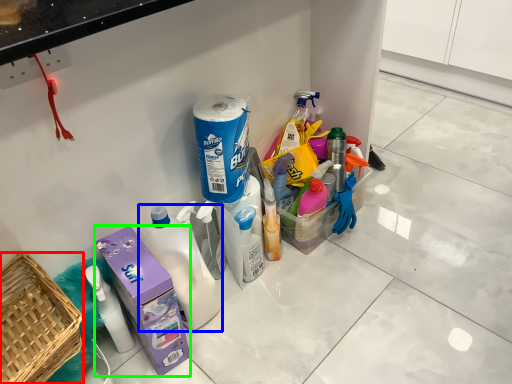
Question: Based on their relative distances, which object is nearer to basket (highlighted by a red box)? Choose from bottle (highlighted by a blue box) and carton (highlighted by a green box).

Choices:
 (A) bottle
 (B) carton

Answer: (B)